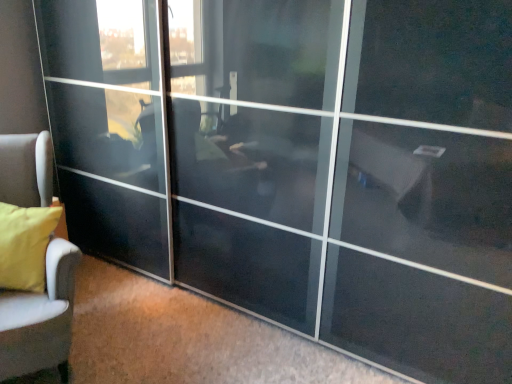
Where is `yellow fabric chair at left`? The width and height of the screenshot is (512, 384). yellow fabric chair at left is located at coordinates tap(40, 317).

What do you see at coordinates (40, 317) in the screenshot? This screenshot has height=384, width=512. I see `yellow fabric chair at left` at bounding box center [40, 317].

Locate an element on the screen. This screenshot has width=512, height=384. yellow fabric chair at left is located at coordinates (40, 317).